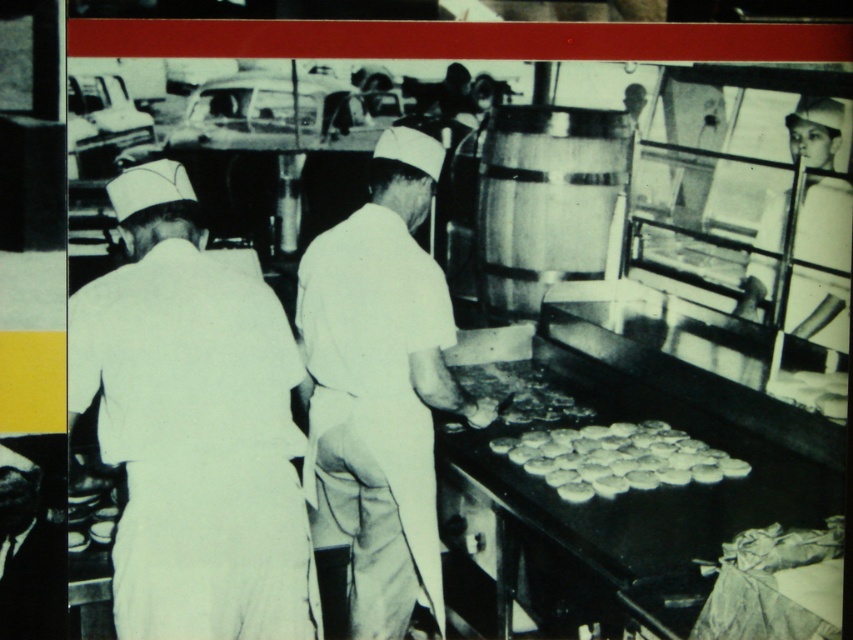
From the picture: Between white uniform at upper right and crumbly golden bread at center, which one appears on the left side from the viewer's perspective?

From the viewer's perspective, crumbly golden bread at center appears more on the left side.

Is white uniform at upper right taller than crumbly golden bread at center?

Indeed, white uniform at upper right has a greater height compared to crumbly golden bread at center.

In order to click on white uniform at upper right in this screenshot , I will do `click(805, 232)`.

At what (x,y) coordinates should I click in order to perform the action: click on white uniform at upper right. Please return your answer as a coordinate pair (x, y). Looking at the image, I should click on (805, 232).

This screenshot has height=640, width=853. What are the coordinates of `white smooth uniform at center` in the screenshot? It's located at (381, 387).

Locate an element on the screen. white smooth uniform at center is located at coordinates (381, 387).

Does white matte cookies at center have a greater width compared to crumbly golden bread at center?

Correct, the width of white matte cookies at center exceeds that of crumbly golden bread at center.

Does white matte cookies at center have a larger size compared to crumbly golden bread at center?

Yes.

At what (x,y) coordinates should I click in order to perform the action: click on white matte cookies at center. Please return your answer as a coordinate pair (x, y). The image size is (853, 640). Looking at the image, I should click on (618, 458).

Identify the location of white matte cookies at center. This screenshot has height=640, width=853. (618, 458).